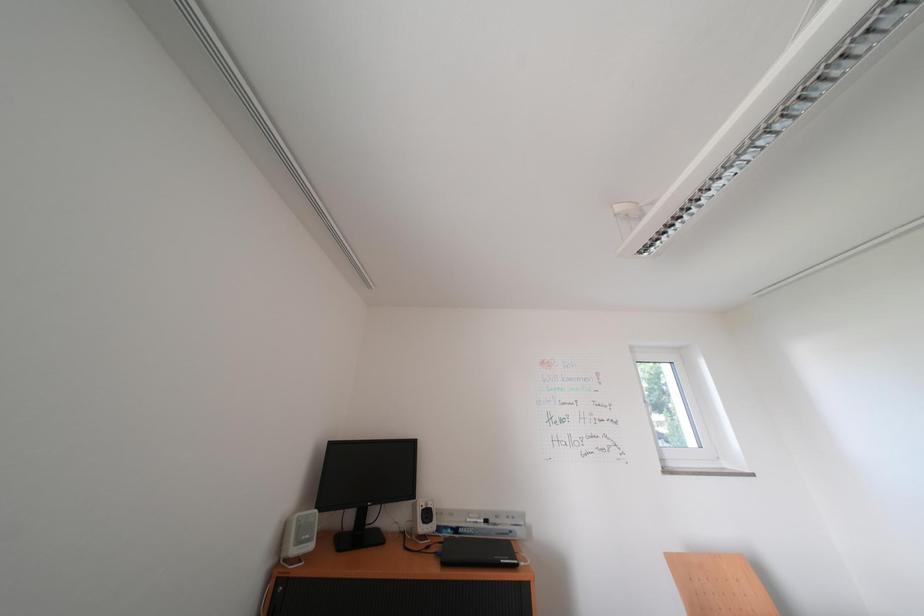
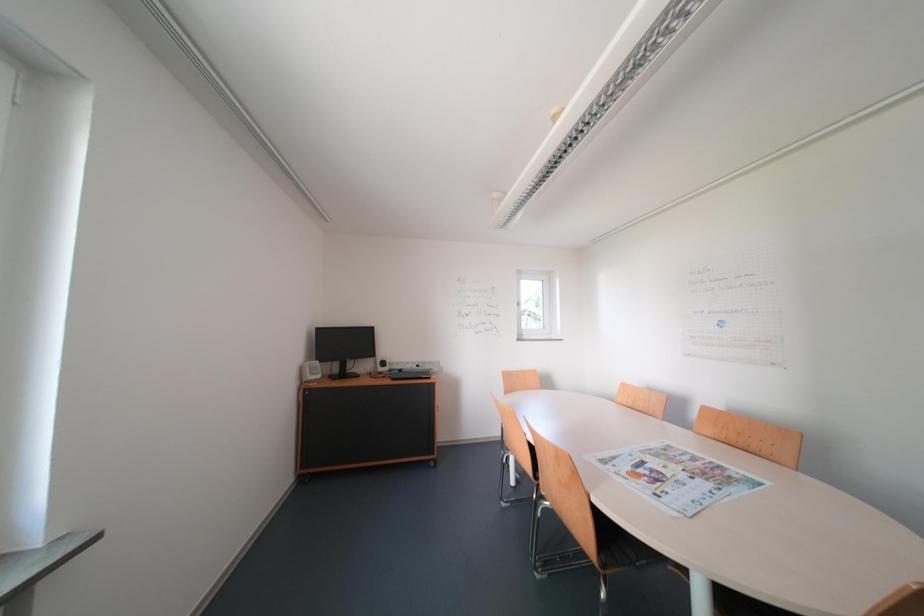
Question: The first image is from the beginning of the video and the second image is from the end. How did the camera likely rotate when shooting the video?

Choices:
 (A) Left
 (B) Right
 (C) Up
 (D) Down

Answer: (D)